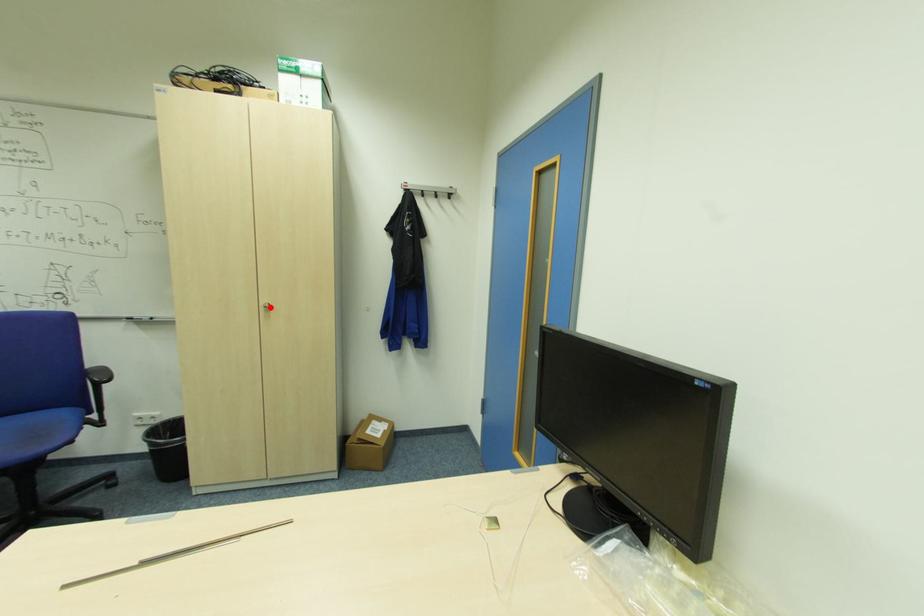
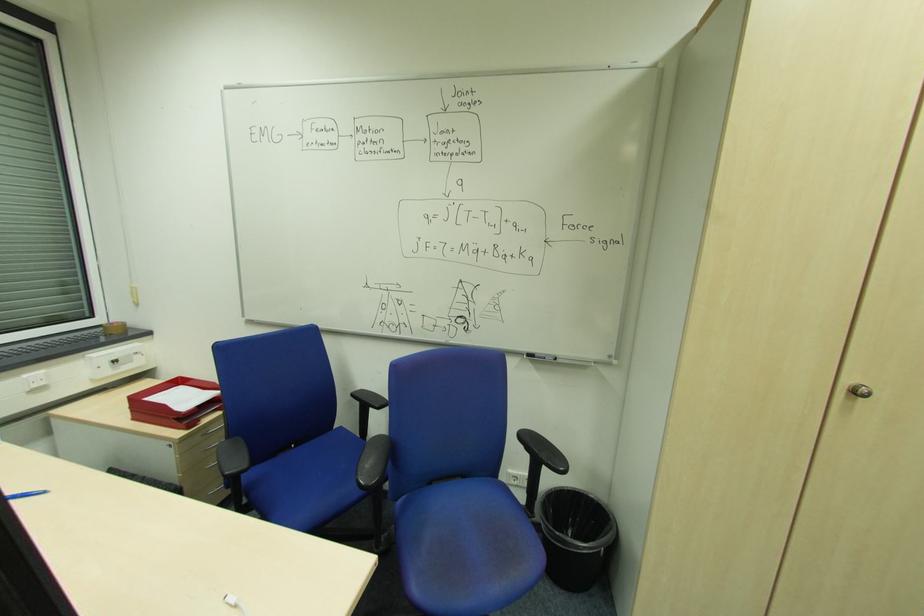
Question: I am providing you with two images of the same scene from different viewpoints. A red point is shown in image1. For the corresponding object point in image2, is it positioned nearer or farther from the camera?

Choices:
 (A) Nearer
 (B) Farther

Answer: (A)